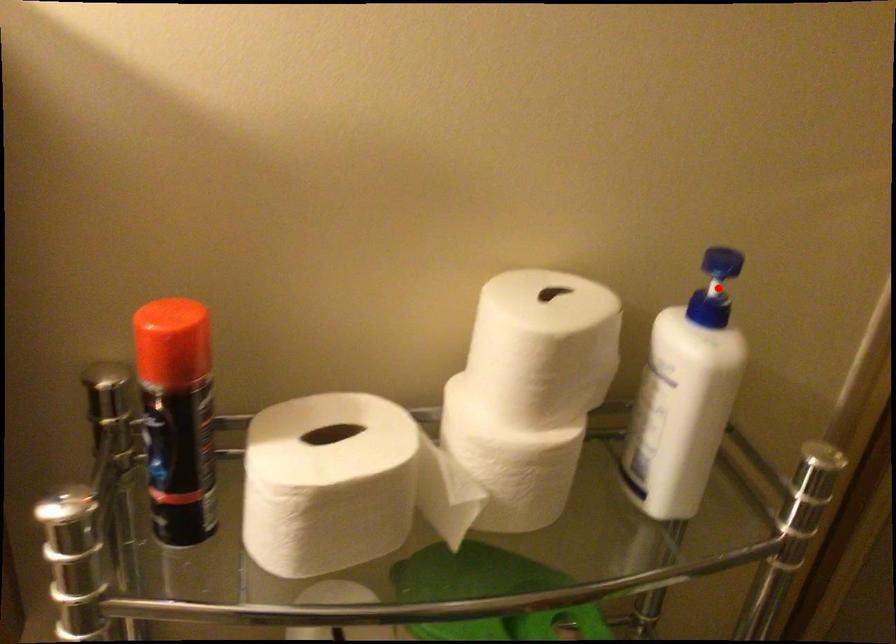
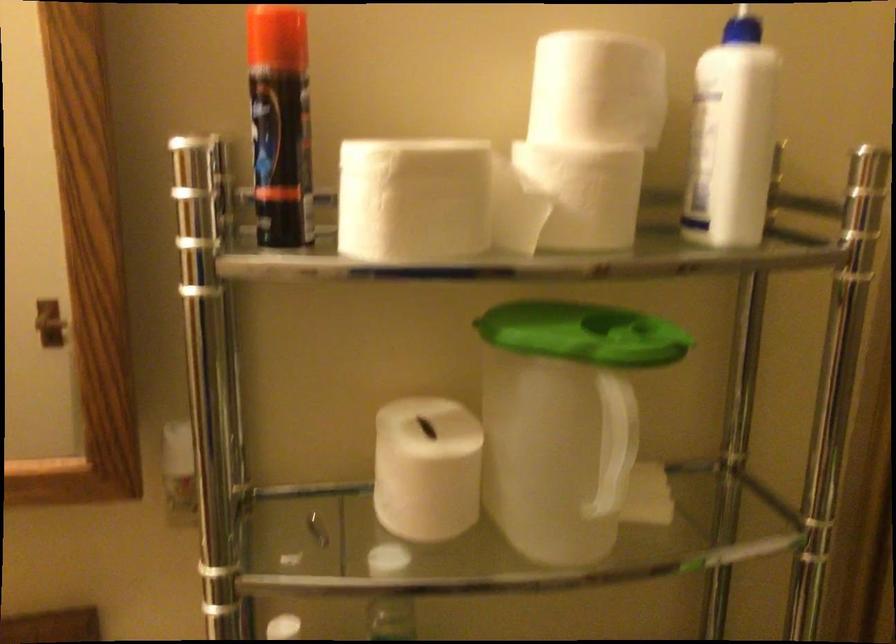
Question: I am providing you with two images of the same scene from different viewpoints. In image1, a red point is highlighted. Considering the same 3D point in image2, which of the following is correct?

Choices:
 (A) It is closer
 (B) It is farther

Answer: (B)